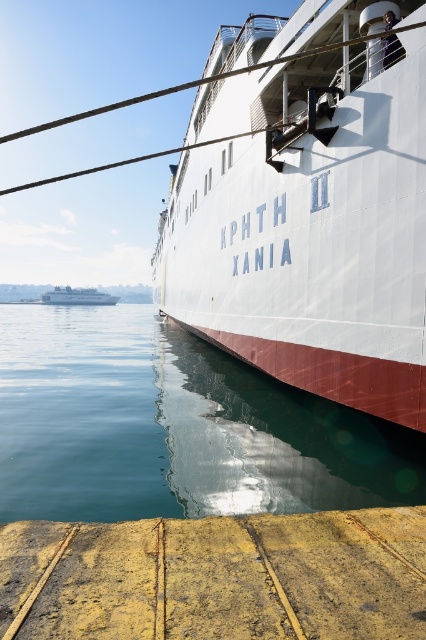
You are a photographer standing on the pier and want to take a picture of the white glossy cruise ship at center. According to the coordinates provided, where should you position yourself to ensure the ship is centered in your photo?

To center the white glossy cruise ship at center in your photo, you should position yourself directly in front of the coordinates point at (307, 209).

You are standing on the pier and want to board the white glossy cruise ship at center. Which direction should you walk relative to the yellow weathered wood at lower center?

You should walk to the left side of the yellow weathered wood at lower center to reach the white glossy cruise ship at center because it is positioned there.